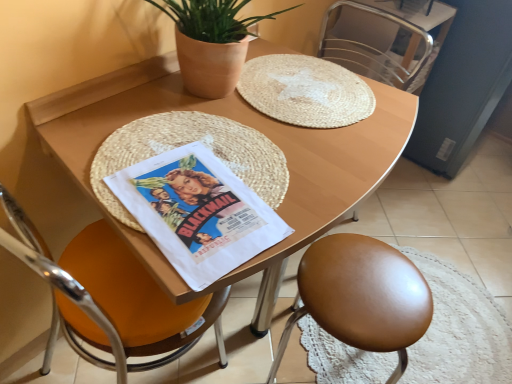
Question: Considering the relative positions of wooden table at center and orange leather chair at left, the 1th chair from the left, in the image provided, is wooden table at center behind orange leather chair at left, the 1th chair from the left,?

Choices:
 (A) no
 (B) yes

Answer: (B)

Question: From a real-world perspective, is wooden table at center located higher than orange leather chair at left, the 1th chair from the left?

Choices:
 (A) yes
 (B) no

Answer: (B)

Question: Can you confirm if wooden table at center is thinner than orange leather chair at left, the 1th chair from the left?

Choices:
 (A) no
 (B) yes

Answer: (A)

Question: Is orange leather chair at left, the third chair positioned from the right, at the back of wooden table at center?

Choices:
 (A) no
 (B) yes

Answer: (A)

Question: Could you tell me if wooden table at center is facing orange leather chair at left, the 1th chair from the left?

Choices:
 (A) no
 (B) yes

Answer: (A)

Question: Is wooden table at center at the right side of orange leather chair at left, the third chair positioned from the right?

Choices:
 (A) yes
 (B) no

Answer: (A)

Question: Can you confirm if metallic silver chair at upper right, the third chair from the left, is wider than brown leather stool at lower right, which is the 2th chair in right-to-left order?

Choices:
 (A) no
 (B) yes

Answer: (A)

Question: Does metallic silver chair at upper right, the third chair from the left, come behind brown leather stool at lower right, the 2th chair positioned from the left?

Choices:
 (A) no
 (B) yes

Answer: (B)

Question: Can you confirm if metallic silver chair at upper right, positioned as the 1th chair in right-to-left order, is taller than brown leather stool at lower right, the 2th chair positioned from the left?

Choices:
 (A) no
 (B) yes

Answer: (A)

Question: Does metallic silver chair at upper right, positioned as the 1th chair in right-to-left order, appear on the left side of brown leather stool at lower right, the 2th chair positioned from the left?

Choices:
 (A) yes
 (B) no

Answer: (B)

Question: Is metallic silver chair at upper right, positioned as the 1th chair in right-to-left order, aimed at brown leather stool at lower right, which is the 2th chair in right-to-left order?

Choices:
 (A) yes
 (B) no

Answer: (B)

Question: Is metallic silver chair at upper right, the third chair from the left, to the right of brown leather stool at lower right, which is the 2th chair in right-to-left order, from the viewer's perspective?

Choices:
 (A) yes
 (B) no

Answer: (A)

Question: Does orange leather chair at left, the 1th chair from the left, have a greater height compared to wooden table at center?

Choices:
 (A) no
 (B) yes

Answer: (B)